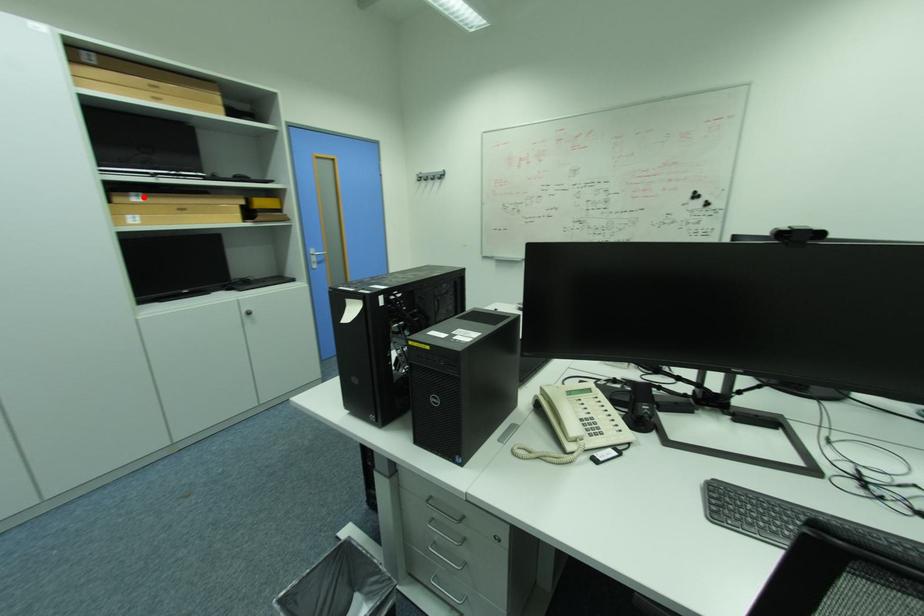
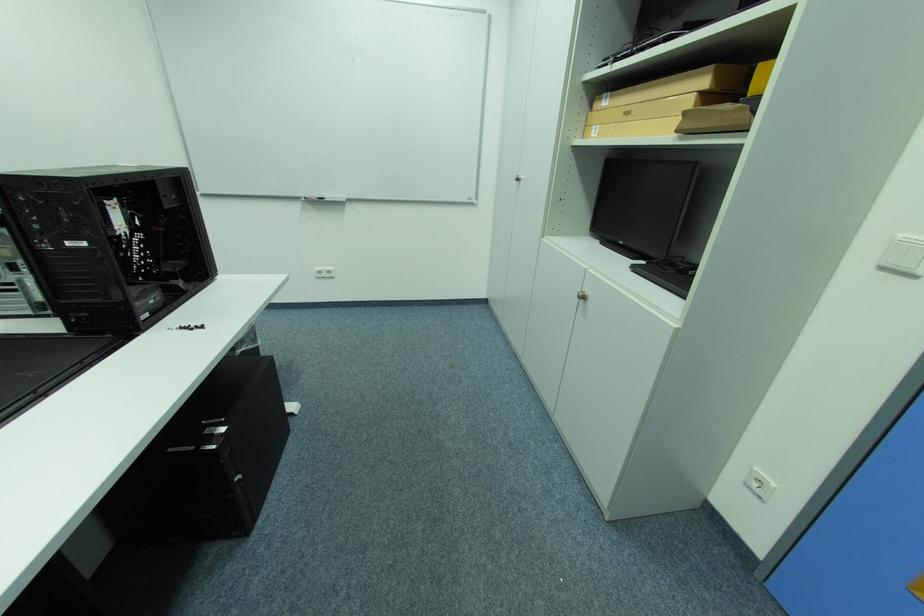
Question: I am providing you with two images of the same scene from different viewpoints. A red point is marked on the first image. Can you still see the location of the red point in image 2?

Choices:
 (A) Yes
 (B) No

Answer: (A)